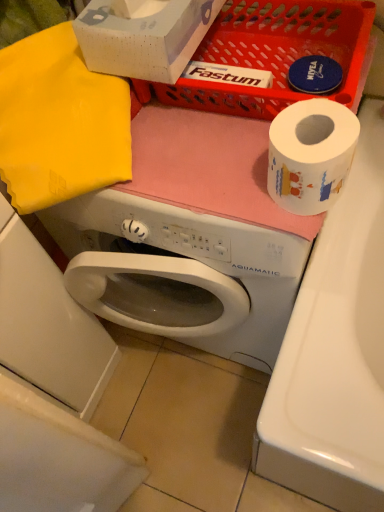
Question: Can you confirm if yellow fabric at upper left is shorter than white matte washing machine at center?

Choices:
 (A) no
 (B) yes

Answer: (B)

Question: Does yellow fabric at upper left appear on the right side of white matte washing machine at center?

Choices:
 (A) no
 (B) yes

Answer: (A)

Question: Is there a large distance between yellow fabric at upper left and white matte washing machine at center?

Choices:
 (A) yes
 (B) no

Answer: (B)

Question: Is yellow fabric at upper left located outside white matte washing machine at center?

Choices:
 (A) no
 (B) yes

Answer: (B)

Question: Does yellow fabric at upper left have a lesser width compared to white matte washing machine at center?

Choices:
 (A) no
 (B) yes

Answer: (B)

Question: Can you confirm if yellow fabric at upper left is smaller than white matte washing machine at center?

Choices:
 (A) no
 (B) yes

Answer: (B)

Question: Considering the relative positions of white matte toilet paper at upper right and yellow fabric at upper left in the image provided, is white matte toilet paper at upper right behind yellow fabric at upper left?

Choices:
 (A) no
 (B) yes

Answer: (A)

Question: Is white matte toilet paper at upper right looking in the opposite direction of yellow fabric at upper left?

Choices:
 (A) yes
 (B) no

Answer: (B)

Question: Are white matte toilet paper at upper right and yellow fabric at upper left beside each other?

Choices:
 (A) yes
 (B) no

Answer: (B)

Question: Is white matte toilet paper at upper right closer to the viewer compared to yellow fabric at upper left?

Choices:
 (A) no
 (B) yes

Answer: (B)

Question: Does white matte toilet paper at upper right appear on the left side of yellow fabric at upper left?

Choices:
 (A) no
 (B) yes

Answer: (A)

Question: Does white matte toilet paper at upper right have a lesser width compared to yellow fabric at upper left?

Choices:
 (A) no
 (B) yes

Answer: (B)

Question: Is white glossy washing machine at lower left wider than white matte toilet paper at upper right?

Choices:
 (A) yes
 (B) no

Answer: (A)